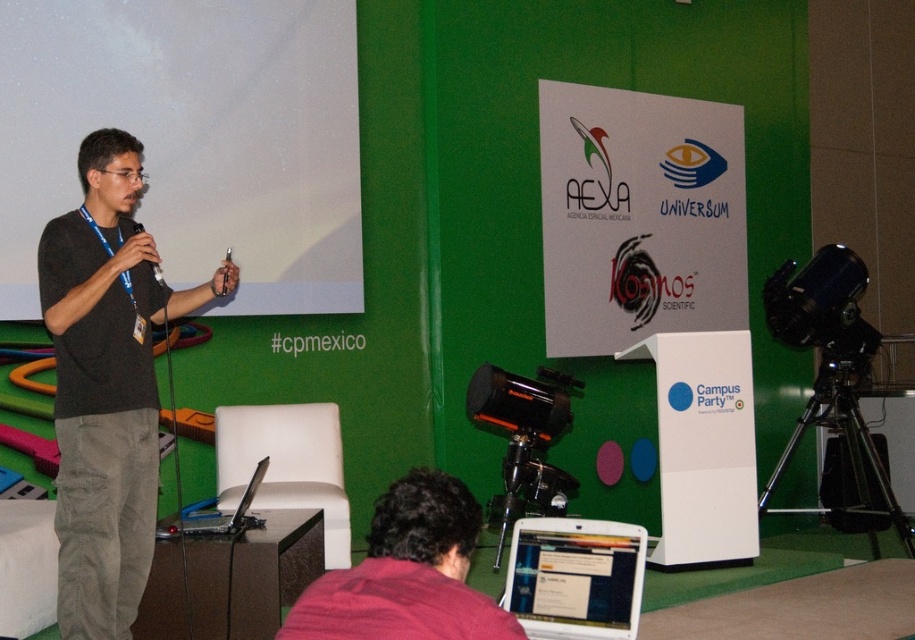
Is white matte projection screen at upper left smaller than silver metallic laptop at lower center?

Incorrect, white matte projection screen at upper left is not smaller in size than silver metallic laptop at lower center.

Does white matte projection screen at upper left have a larger size compared to silver metallic laptop at lower center?

Yes.

Between point (326, 268) and point (231, 524), which one is positioned behind?

Positioned behind is point (326, 268).

The width and height of the screenshot is (915, 640). What are the coordinates of `white matte projection screen at upper left` in the screenshot? It's located at (192, 138).

Which of these two, white glossy laptop at lower center or silver metallic laptop at lower center, stands shorter?

silver metallic laptop at lower center

Find the location of a particular element. white glossy laptop at lower center is located at coordinates (576, 577).

Image resolution: width=915 pixels, height=640 pixels. In order to click on white glossy laptop at lower center in this screenshot , I will do `click(576, 577)`.

Image resolution: width=915 pixels, height=640 pixels. Find the location of `white glossy laptop at lower center`. white glossy laptop at lower center is located at coordinates (576, 577).

Can you confirm if pink fabric at lower center is positioned to the right of black plastic microphone at upper left?

Yes, pink fabric at lower center is to the right of black plastic microphone at upper left.

What do you see at coordinates (407, 573) in the screenshot?
I see `pink fabric at lower center` at bounding box center [407, 573].

Where is `pink fabric at lower center`? The image size is (915, 640). pink fabric at lower center is located at coordinates (407, 573).